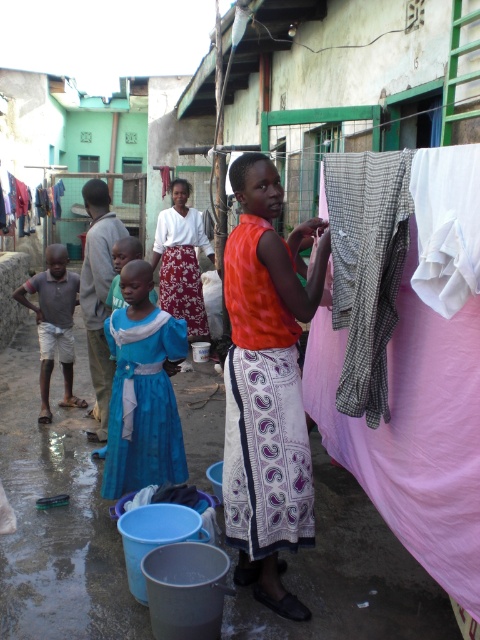
Question: Which point appears farthest from the camera in this image?

Choices:
 (A) (127, 460)
 (B) (24, 292)
 (C) (282, 604)

Answer: (B)

Question: Does pink fabric clothesline at center appear on the left side of blue satin dress at center?

Choices:
 (A) yes
 (B) no

Answer: (A)

Question: Observing the image, what is the correct spatial positioning of orange fabric dress at center in reference to matte gray shirt at left?

Choices:
 (A) left
 (B) right

Answer: (B)

Question: Estimate the real-world distances between objects in this image. Which object is farther from the pink fabric clothesline at center?

Choices:
 (A) white printed fabric dress at center
 (B) matte gray shirt at left

Answer: (B)

Question: Among these points, which one is nearest to the camera?

Choices:
 (A) (151, 342)
 (B) (191, 326)
 (C) (259, 500)
 (D) (51, 342)

Answer: (C)

Question: Does matte blue dress at center appear on the left side of matte gray shirt at left?

Choices:
 (A) no
 (B) yes

Answer: (A)